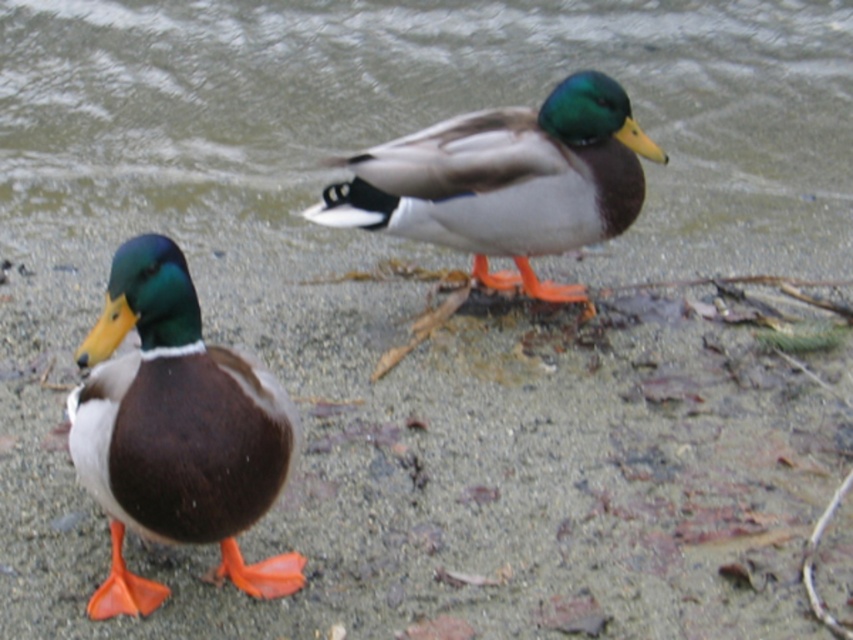
You are a photographer aiming to capture the shiny brown duck at center without the clear water at upper center obstructing the view. Is the duck positioned behind or in front of the water?

The shiny brown duck at center is behind the clear water at upper center, so it will not obstruct the view of the duck.

Looking at this image, you are a photographer trying to capture a photo of the matte brown duck at left and the clear water at upper center. If you want to focus on the duck first, which object should you adjust your camera to focus on first?

The matte brown duck at left is behind clear water at upper center, so you should focus on the matte brown duck at left first.

From the picture: You are standing at the origin point in the image. Which direction should you move to reach the matte brown duck at left?

The matte brown duck at left is located at point (x=177, y=432), so you should move to the right and slightly downward to reach it from the origin point.